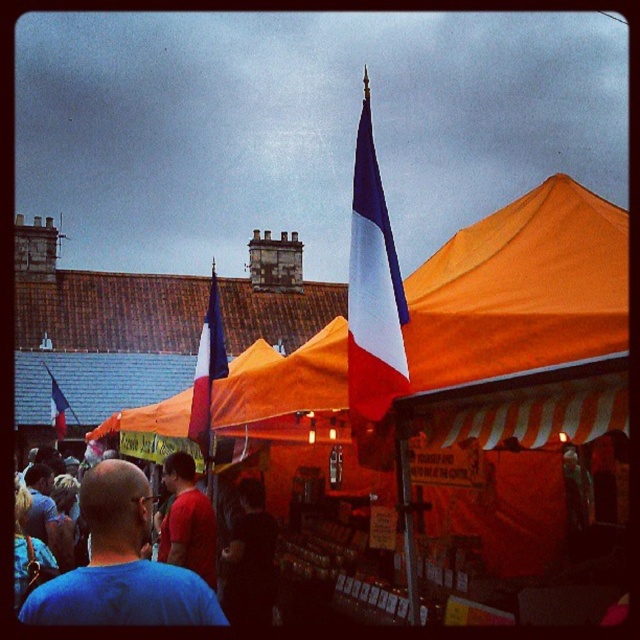
You are a photographer at the market and want to capture both the red cotton shirt at center and the french flag at center in a single frame. Since the shirt is narrower than the flag, which object should you focus on to ensure both fit in the shot?

The red cotton shirt at center has a lesser width compared to the french flag at center. To ensure both fit in the shot, focus on the wider french flag at center, as it requires more space, and the narrower red cotton shirt at center will naturally fit within the frame.

You are a photographer at the market and want to take a photo of the red cotton shirt at center without the french flag at center appearing in the background. Is this possible given their positions?

The red cotton shirt at center is positioned under the french flag at center, so they are directly aligned. This means the flag would likely block the shirt in the photo unless you adjust your angle or move the shirt.